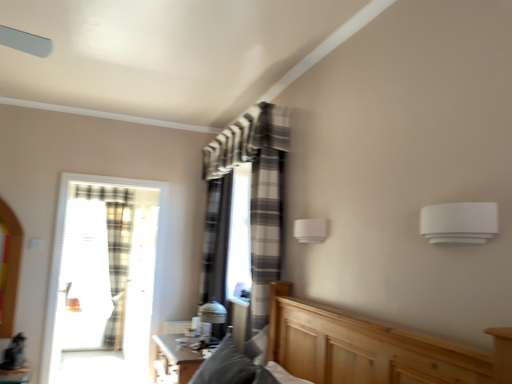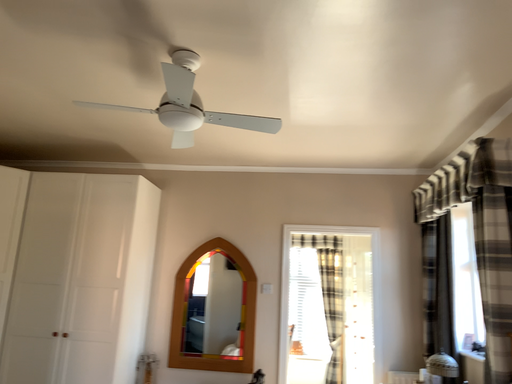
Question: How did the camera likely rotate when shooting the video?

Choices:
 (A) rotated left
 (B) rotated right

Answer: (A)